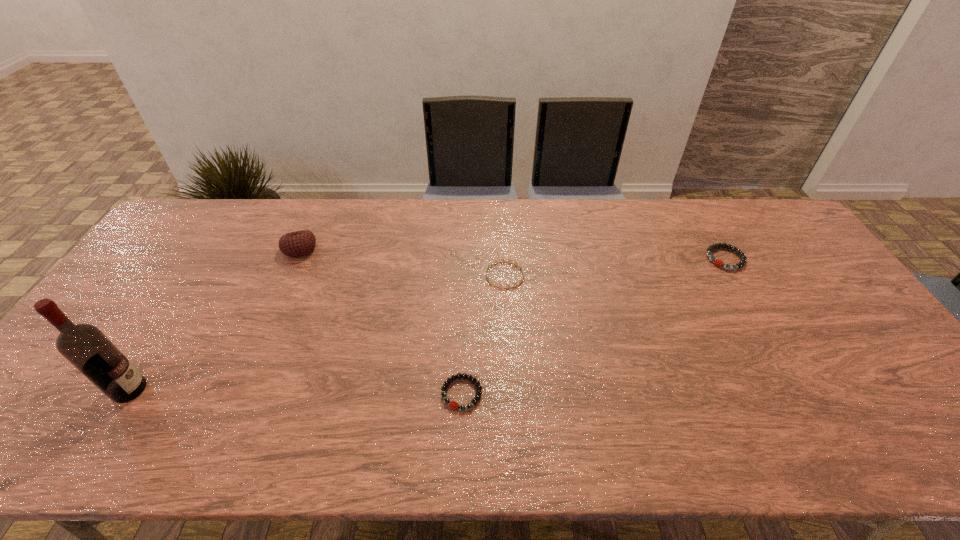
You are a GUI agent. You are given a task and a screenshot of the screen. Output one action in this format:
    pyautogui.click(x=<x>, y=<y>)
    Task: Click on the free space that satisfies the following two spatial constraints: 1. on the front side of the rightmost bracelet; 2. on the front and back of the alcohol
    
    Given the screenshot: What is the action you would take?
    802,390

Where is `free spot that satisfies the following two spatial constraints: 1. on the front and back of the leftmost object; 2. on the right side of the nearest bracelet`? The height and width of the screenshot is (540, 960). free spot that satisfies the following two spatial constraints: 1. on the front and back of the leftmost object; 2. on the right side of the nearest bracelet is located at coordinates (127, 394).